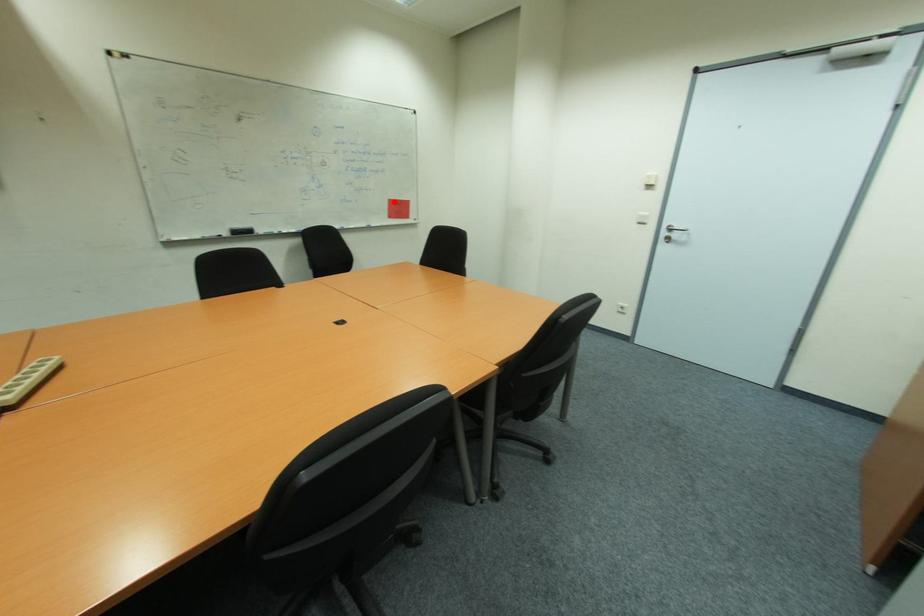
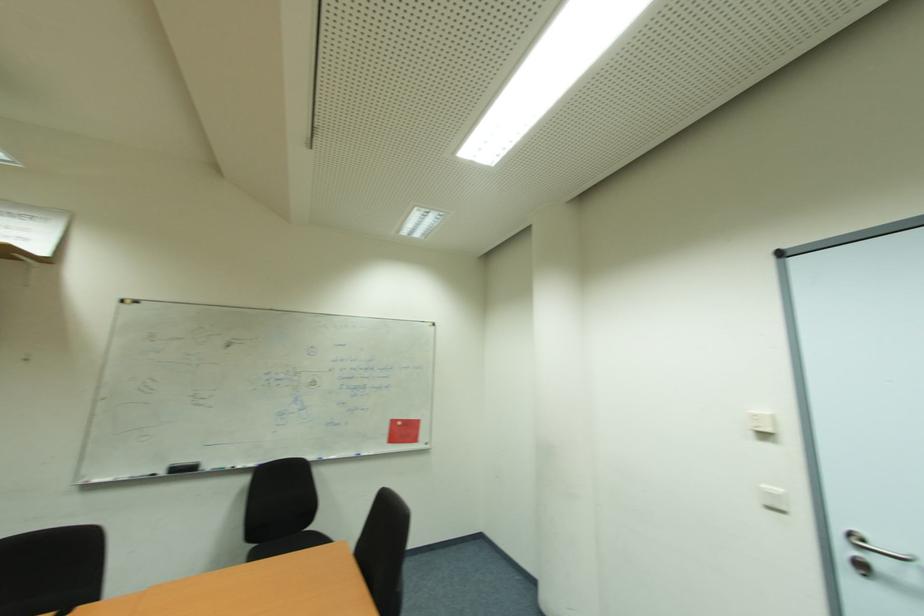
Question: I am providing you with two images of the same scene from different viewpoints. Image1 has a red point marked. In image2, the corresponding 3D location appears at what relative position? Reply with the corresponding letter.

Choices:
 (A) Closer
 (B) Farther

Answer: (B)